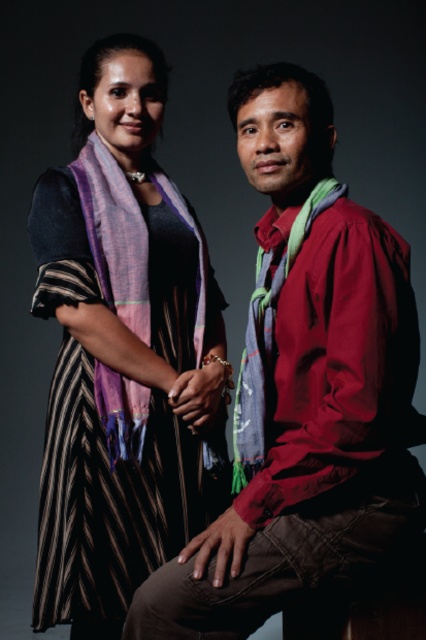
Question: Does matte red shirt at center come behind blue textured scarf at center?

Choices:
 (A) yes
 (B) no

Answer: (B)

Question: Does striped fabric dress at center appear on the left side of multicolored woven scarf at center?

Choices:
 (A) no
 (B) yes

Answer: (B)

Question: Which of the following is the farthest from the observer?

Choices:
 (A) blue textured scarf at center
 (B) striped fabric dress at center
 (C) matte red shirt at center

Answer: (B)

Question: Which point is farther to the camera?

Choices:
 (A) (261, 371)
 (B) (132, 156)

Answer: (B)

Question: Does striped fabric dress at center have a smaller size compared to multicolored woven scarf at center?

Choices:
 (A) yes
 (B) no

Answer: (B)

Question: Which of the following is the farthest from the observer?

Choices:
 (A) (109, 445)
 (B) (261, 188)
 (C) (270, 337)
 (D) (123, 221)

Answer: (D)